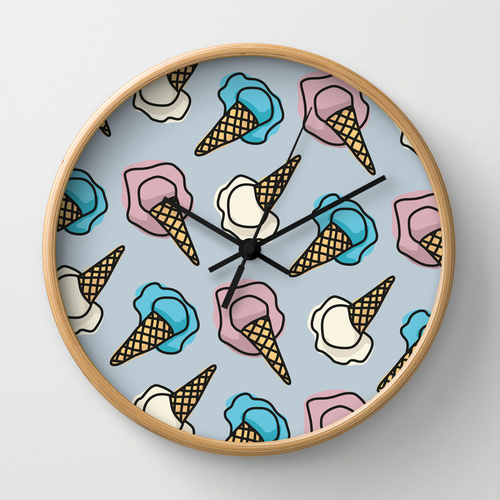
Image resolution: width=500 pixels, height=500 pixels. Identify the location of wall. (393, 451).